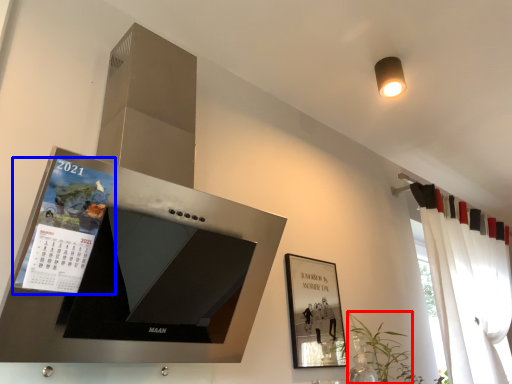
Question: Which of the following is the farthest to the observer, plant (highlighted by a red box) or magazine (highlighted by a blue box)?

Choices:
 (A) plant
 (B) magazine

Answer: (A)